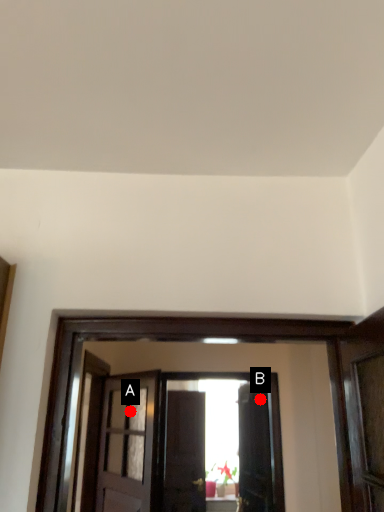
Question: Two points are circled on the image, labeled by A and B beside each circle. Which point is closer to the camera?

Choices:
 (A) A is closer
 (B) B is closer

Answer: (A)